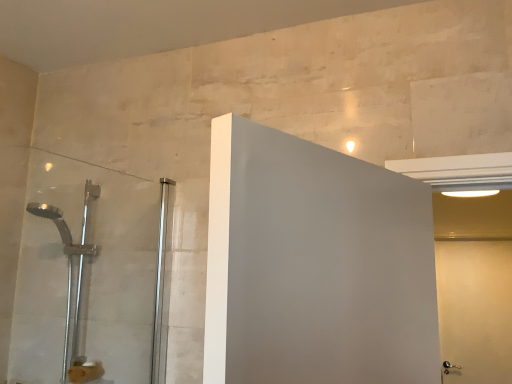
Question: Can you confirm if white matte door at right is taller than satin chrome shower door at left?

Choices:
 (A) no
 (B) yes

Answer: (B)

Question: Is white matte door at right oriented away from satin chrome shower door at left?

Choices:
 (A) yes
 (B) no

Answer: (B)

Question: From the image's perspective, does white matte door at right appear higher than satin chrome shower door at left?

Choices:
 (A) no
 (B) yes

Answer: (A)

Question: From a real-world perspective, is white matte door at right on satin chrome shower door at left?

Choices:
 (A) yes
 (B) no

Answer: (B)

Question: From the image's perspective, is white matte door at right under satin chrome shower door at left?

Choices:
 (A) no
 (B) yes

Answer: (B)

Question: Is white matte door at right facing towards satin chrome shower door at left?

Choices:
 (A) no
 (B) yes

Answer: (A)

Question: From the image's perspective, is satin chrome shower door at left located beneath white matte door at right?

Choices:
 (A) yes
 (B) no

Answer: (B)

Question: Is satin chrome shower door at left directly adjacent to white matte door at right?

Choices:
 (A) yes
 (B) no

Answer: (B)

Question: Is satin chrome shower door at left wider than white matte door at right?

Choices:
 (A) yes
 (B) no

Answer: (A)

Question: Considering the relative sizes of satin chrome shower door at left and white matte door at right in the image provided, is satin chrome shower door at left smaller than white matte door at right?

Choices:
 (A) yes
 (B) no

Answer: (B)

Question: Could you tell me if satin chrome shower door at left is facing white matte door at right?

Choices:
 (A) yes
 (B) no

Answer: (B)

Question: Is satin chrome shower door at left shorter than white matte door at right?

Choices:
 (A) no
 (B) yes

Answer: (B)

Question: From the image's perspective, is satin chrome shower door at left positioned above or below white matte door at right?

Choices:
 (A) above
 (B) below

Answer: (A)